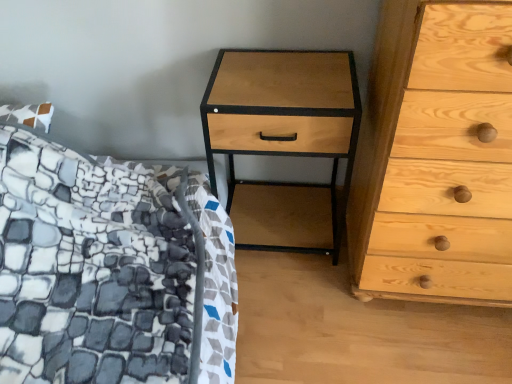
You are a GUI agent. You are given a task and a screenshot of the screen. Output one action in this format:
    pyautogui.click(x=<x>, y=<y>)
    Task: Click on the space that is in front of natural wood nightstand at center
    The width and height of the screenshot is (512, 384).
    Given the screenshot: What is the action you would take?
    pyautogui.click(x=302, y=313)